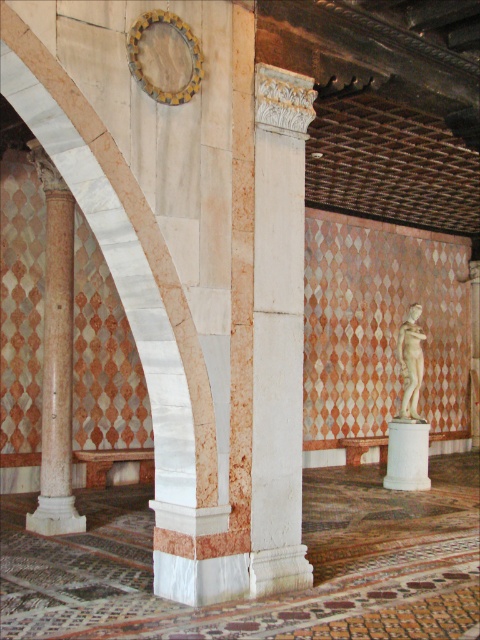
Does marble column at left have a smaller size compared to white marble statue at center?

Incorrect, marble column at left is not smaller in size than white marble statue at center.

Find the location of a particular element. Image resolution: width=480 pixels, height=640 pixels. marble column at left is located at coordinates (57, 360).

Can you confirm if white marble column at center is positioned below marble column at left?

Actually, white marble column at center is above marble column at left.

From the picture: Can you confirm if white marble column at center is positioned above marble column at left?

Correct, white marble column at center is located above marble column at left.

Who is more forward, [255,164] or [67,496]?

Positioned in front is point [255,164].

Locate an element on the screen. white marble column at center is located at coordinates (277, 330).

Is white marble column at center taller than white marble statue at center?

Indeed, white marble column at center has a greater height compared to white marble statue at center.

Who is more forward, (263, 388) or (410, 358)?

Point (263, 388) is in front.

This screenshot has width=480, height=640. I want to click on white marble column at center, so click(277, 330).